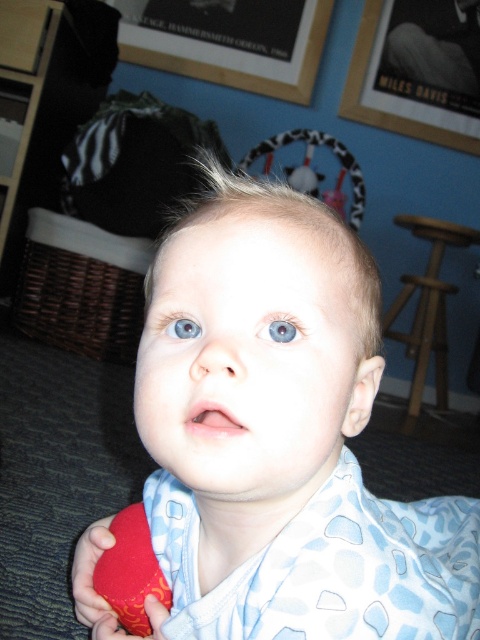
You are a photographer adjusting your camera settings to focus on the blue glossy eye at center. However, you also want to ensure the wooden framed picture at upper center remains in the frame. Based on their positions, which object is closer to the camera?

The wooden framed picture at upper center is closer to the camera because it is further to the viewer than the blue glossy eye at center.

Based on the photo, you are standing in the living room and want to hang a new picture on the wall. The existing wooden framed picture at upper center is located at point [418,70]. If you want to place the new picture 0.1 units to the right of the existing one, what coordinate should you aim for?

The existing wooden framed picture at upper center is at point [418,70]. To place the new picture 0.1 units to the right, add 0.1 to the x coordinate. The new coordinate would be 0.211, 0.871.

You are organizing a playroom and need to place a toy in a safe location away from the wall. The wooden framed picture at upper center and the rubber duck at lower left are in the scene. Which object is closer to the wall?

The wooden framed picture at upper center is positioned over the rubber duck at lower left, so the rubber duck at lower left is closer to the wall.